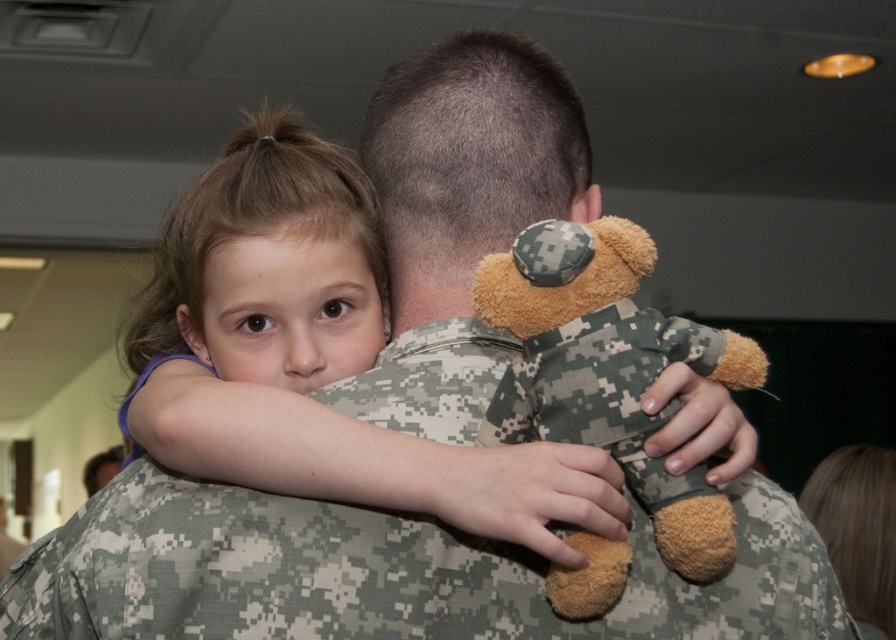
Does camouflage fabric uniform at back come behind matte brown hair at upper left?

Yes, camouflage fabric uniform at back is behind matte brown hair at upper left.

Identify the location of camouflage fabric uniform at back. tap(384, 573).

Who is positioned more to the left, matte brown hair at upper left or camouflage fabric teddy bear at upper center?

From the viewer's perspective, matte brown hair at upper left appears more on the left side.

Between matte brown hair at upper left and camouflage fabric teddy bear at upper center, which one has less height?

camouflage fabric teddy bear at upper center

Locate an element on the screen. The height and width of the screenshot is (640, 896). matte brown hair at upper left is located at coordinates (315, 355).

Does camouflage fabric uniform at back appear on the right side of camouflage fabric teddy bear at upper center?

Incorrect, camouflage fabric uniform at back is not on the right side of camouflage fabric teddy bear at upper center.

Is point (476, 548) positioned behind point (610, 304)?

Yes, point (476, 548) is behind point (610, 304).

This screenshot has width=896, height=640. Find the location of `camouflage fabric uniform at back`. camouflage fabric uniform at back is located at coordinates (384, 573).